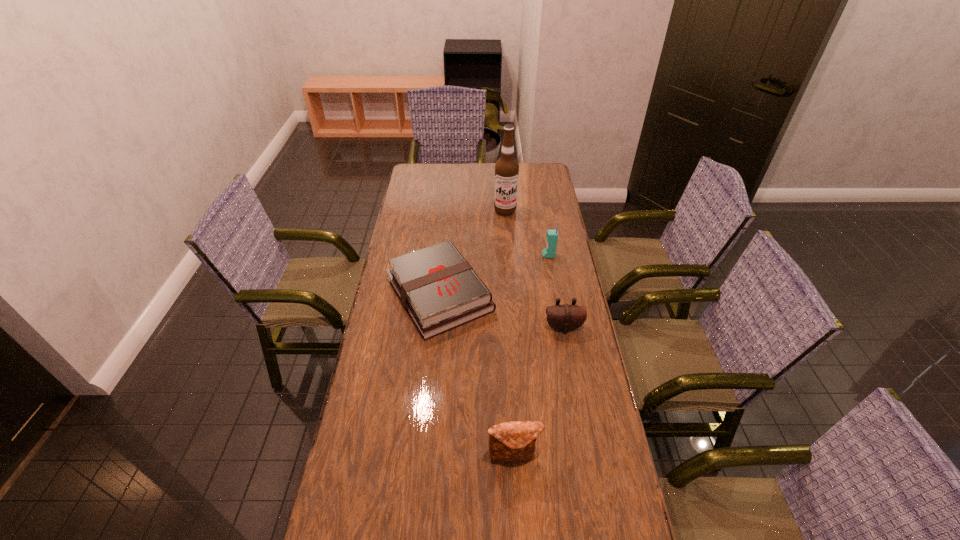
Identify the location of free space located 0.130m on the open side of the clutch bag. This screenshot has height=540, width=960. (517, 522).

Locate an element on the screen. This screenshot has height=540, width=960. vacant position located 0.150m with the flap open on the second shortest object is located at coordinates (571, 372).

Where is `free space located on the front of the shortest object`? This screenshot has height=540, width=960. free space located on the front of the shortest object is located at coordinates tap(432, 379).

You are a GUI agent. You are given a task and a screenshot of the screen. Output one action in this format:
    pyautogui.click(x=<x>, y=<y>)
    Task: Click on the object at the left edge
    
    Given the screenshot: What is the action you would take?
    coord(438,288)

This screenshot has width=960, height=540. Identify the location of cellular telephone located at the right edge. (x=552, y=235).

Locate an element on the screen. Image resolution: width=960 pixels, height=540 pixels. pouch located at the right edge is located at coordinates pyautogui.click(x=564, y=318).

In the image, there is a desktop. Where is `vacant space at the far edge`? vacant space at the far edge is located at coordinates (485, 163).

Where is `vacant area at the left edge of the desktop`? Image resolution: width=960 pixels, height=540 pixels. vacant area at the left edge of the desktop is located at coordinates (414, 201).

Where is `vacant area at the right edge`? vacant area at the right edge is located at coordinates (554, 200).

Locate an element on the screen. This screenshot has height=540, width=960. free space at the far left corner is located at coordinates (424, 177).